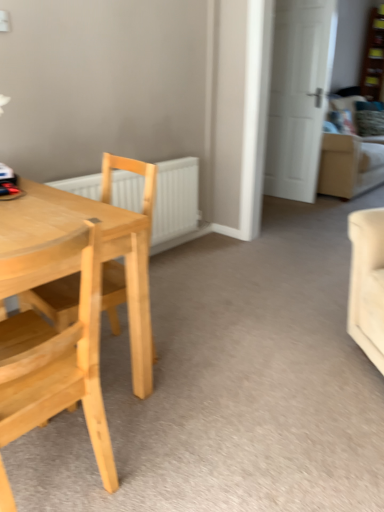
Locate an element on the screen. This screenshot has height=512, width=384. free region under white matte radiator at center (from a real-world perspective) is located at coordinates pos(168,249).